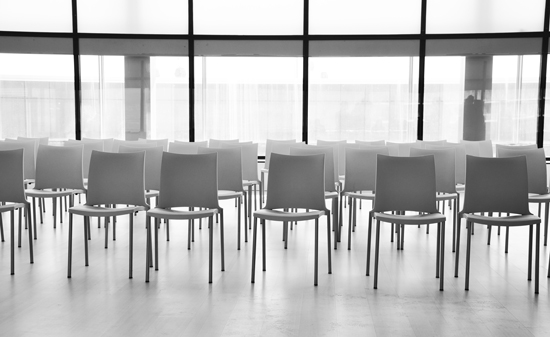
Locate an element on the screen. The height and width of the screenshot is (337, 550). big windows is located at coordinates (56, 10), (133, 10), (253, 13), (383, 18), (487, 19), (475, 81), (356, 87), (246, 93), (131, 83), (44, 103).